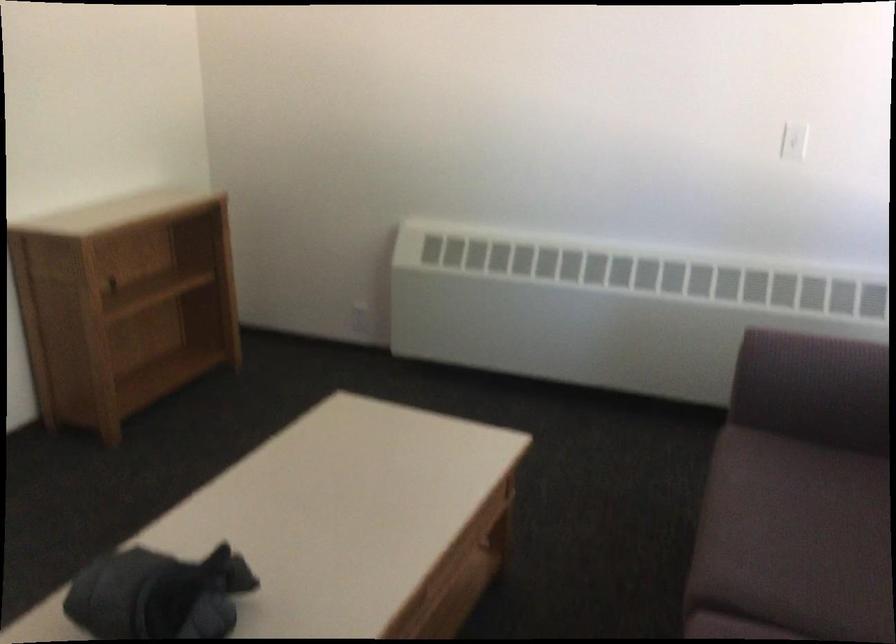
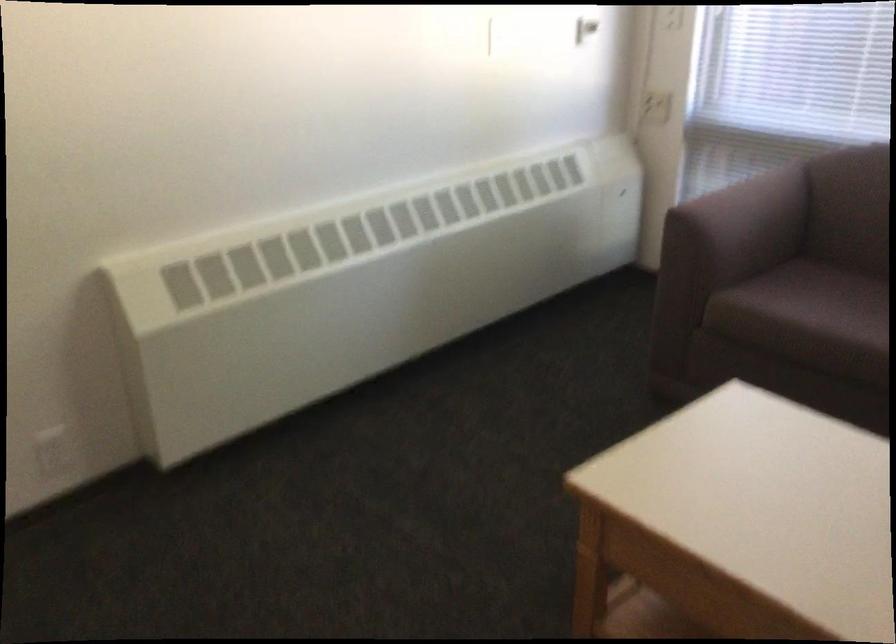
In the second image, find the point that corresponds to (x=786, y=477) in the first image.

(807, 303)